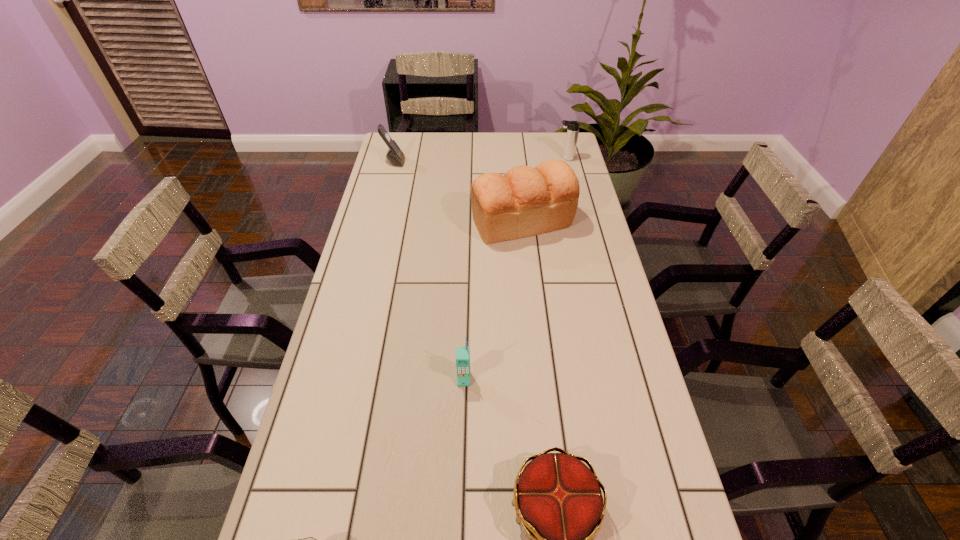
Identify the location of vacant region at the left edge of the desktop. (329, 403).

You are a GUI agent. You are given a task and a screenshot of the screen. Output one action in this format:
    pyautogui.click(x=<x>, y=<y>)
    Task: Click on the vacant point at the right edge
    This screenshot has height=540, width=960.
    Given the screenshot: What is the action you would take?
    pyautogui.click(x=671, y=536)

What are the coordinates of `free region at the far left corner of the desktop` in the screenshot? It's located at (385, 149).

Identify the location of vacant point located between the tallest object and the farther cellular telephone. (458, 192).

Identify the location of unoccupied area between the thermos bottle and the fourth farthest object. Image resolution: width=960 pixels, height=540 pixels. (515, 268).

Locate an element on the screen. vacant area that lies between the tallest object and the fourth farthest object is located at coordinates (492, 301).

At what (x,y) coordinates should I click in order to perform the action: click on object that stands as the closest to the crown. Please return your answer as a coordinate pair (x, y). The width and height of the screenshot is (960, 540). Looking at the image, I should click on (462, 353).

Locate an element on the screen. object identified as the third closest to the third farthest object is located at coordinates (462, 353).

At what (x,y) coordinates should I click in order to perform the action: click on vacant space that satisfies the following two spatial constraints: 1. on the handle side of the thermos bottle; 2. on the keypad of the nearer cellular telephone. Please return your answer as a coordinate pair (x, y). The image size is (960, 540). Looking at the image, I should click on (622, 379).

You are a GUI agent. You are given a task and a screenshot of the screen. Output one action in this format:
    pyautogui.click(x=<x>, y=<y>)
    Task: Click on the free point that satisfies the following two spatial constraints: 1. on the front-facing side of the farther cellular telephone; 2. on the left side of the tallest object
    
    Given the screenshot: What is the action you would take?
    pyautogui.click(x=379, y=222)